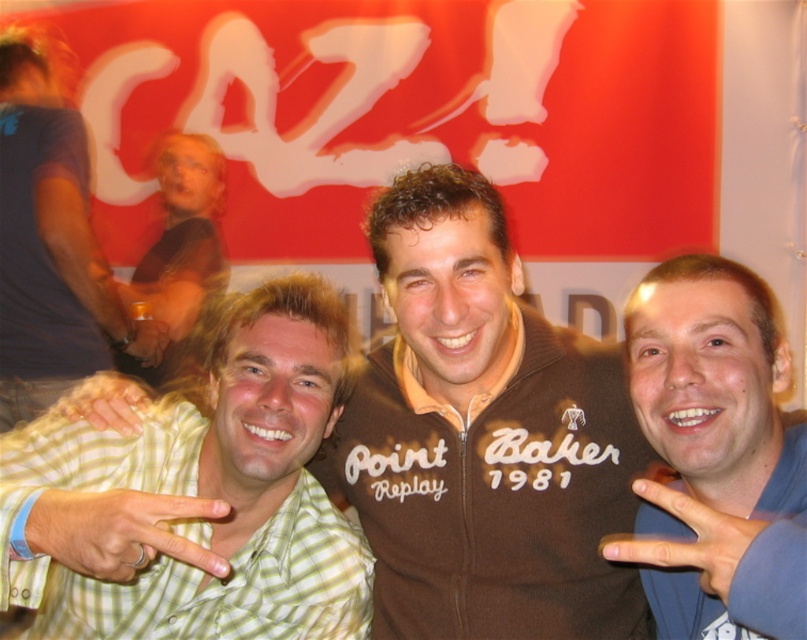
You are a photographer trying to frame a closeup shot of the green checkered shirt at center and the smooth skin hand at lower right. Which object should you focus on first if you want to capture both in the same frame without moving the camera?

The green checkered shirt at center might be wider than smooth skin hand at lower right, so you should focus on the green checkered shirt at center first to ensure it fits within the frame.

You are a photographer trying to adjust the lighting for a photo shoot. You notice a point at coordinates (46, 243) in the image. According to the scene description, what is located at this point?

The point at coordinates (46, 243) corresponds to light brown hair at left.

In the photo, there are two people wearing distinct clothing items. The first is a green checkered shirt at center and the second is a smooth skin hand at lower right. Based on their positions, which clothing item is positioned more to the left?

The green checkered shirt at center is positioned more to the left than the smooth skin hand at lower right.